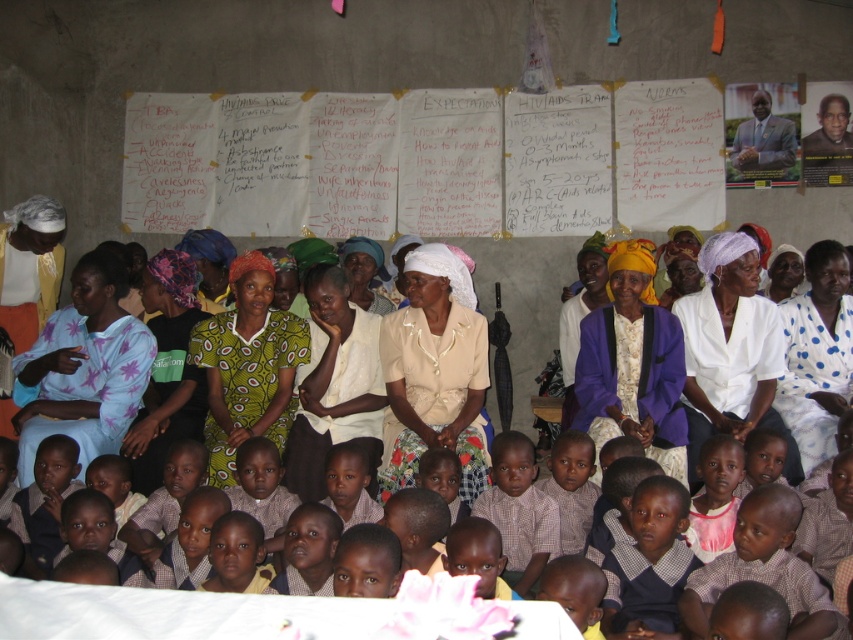
Based on the scene description, which object is positioned higher in the image between the purple fabric jacket at center and the yellow fabric headscarf at center?

The purple fabric jacket at center is positioned higher than the yellow fabric headscarf at center according to the description.

You are standing in front of the image and want to touch the two points marked in the scene. Which point, point (665, 401) or point (366, 291), would you reach first?

Point (665, 401) is closer to the camera than point (366, 291), so you would reach point (665, 401) first.